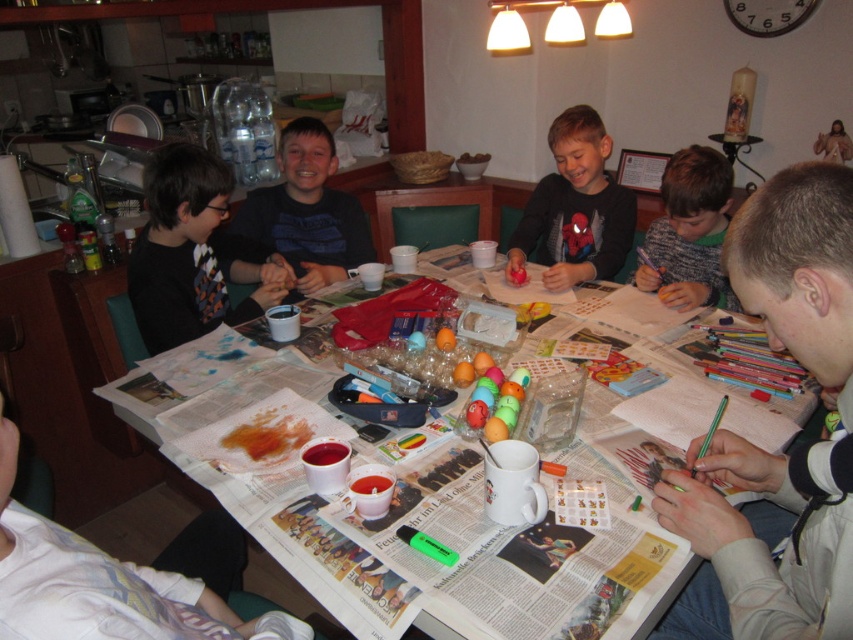
You are standing in the kitchen and want to reach the point marked at coordinates (791,456). The table is 4 feet long. Can you walk straight to it without moving around the table?

The point marked at coordinates (791,456) is 3.44 feet away from the camera, which is within the length of the 4 feet table. Therefore, you can walk straight to it without needing to move around the table.

You are a photographer standing behind the table and want to capture both the smooth gray shirt at lower right and the matte black shirt at center in the same frame. Since you can only adjust the camera angle slightly, which shirt will appear taller in the photo?

The smooth gray shirt at lower right is taller than the matte black shirt at center, so it will appear taller in the photo.